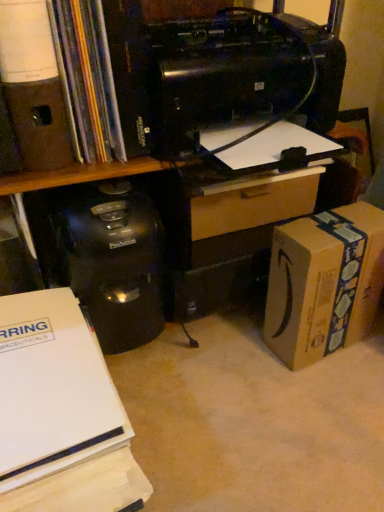
Locate an element on the screen. This screenshot has height=512, width=384. matte brown speaker at upper left, which is the 1th office supplies from top to bottom is located at coordinates (34, 85).

Describe the element at coordinates (323, 283) in the screenshot. This screenshot has height=512, width=384. I see `brown cardboard box at lower right` at that location.

This screenshot has height=512, width=384. Find the location of `wooden drawer at center`. wooden drawer at center is located at coordinates (253, 202).

What is the approximate width of wooden drawer at center?

The width of wooden drawer at center is 3.94 inches.

Describe the element at coordinates (60, 412) in the screenshot. The width and height of the screenshot is (384, 512). I see `white paper at lower left, placed as the 2th office supplies when sorted from top to bottom` at that location.

The width and height of the screenshot is (384, 512). What are the coordinates of `matte brown speaker at upper left, placed as the second office supplies when sorted from bottom to top` in the screenshot? It's located at (34, 85).

Do you think white paper at lower left, positioned as the 1th office supplies in bottom-to-top order, is within matte brown speaker at upper left, placed as the second office supplies when sorted from bottom to top, or outside of it?

white paper at lower left, positioned as the 1th office supplies in bottom-to-top order, lies outside matte brown speaker at upper left, placed as the second office supplies when sorted from bottom to top.

Which is in front, point (58, 398) or point (43, 108)?

The point (58, 398) is in front.

Is white paper at lower left, positioned as the 1th office supplies in bottom-to-top order, with matte brown speaker at upper left, placed as the second office supplies when sorted from bottom to top?

white paper at lower left, positioned as the 1th office supplies in bottom-to-top order, and matte brown speaker at upper left, placed as the second office supplies when sorted from bottom to top, are clearly separated.

Can you tell me how much white paper at lower left, placed as the 2th office supplies when sorted from top to bottom, and matte brown speaker at upper left, placed as the second office supplies when sorted from bottom to top, differ in facing direction?

2.11 degrees.

You are a GUI agent. You are given a task and a screenshot of the screen. Output one action in this format:
    pyautogui.click(x=<x>, y=<y>)
    Task: Click on the printer located on the left of wooden drawer at center
    The height and width of the screenshot is (512, 384).
    Given the screenshot: What is the action you would take?
    pos(219,75)

In the image, is black plastic printer at upper center positioned in front of or behind wooden drawer at center?

black plastic printer at upper center is in front of wooden drawer at center.

Is black plastic printer at upper center oriented towards wooden drawer at center?

No, black plastic printer at upper center is not turned towards wooden drawer at center.

From the image's perspective, is black plastic printer at upper center beneath wooden drawer at center?

No, from the image's perspective, black plastic printer at upper center is not below wooden drawer at center.

Does matte brown speaker at upper left, placed as the second office supplies when sorted from bottom to top, lie behind matte black book at upper left?

No, matte brown speaker at upper left, placed as the second office supplies when sorted from bottom to top, is in front of matte black book at upper left.

Considering the sizes of objects matte brown speaker at upper left, which is the 1th office supplies from top to bottom, and matte black book at upper left in the image provided, who is taller, matte brown speaker at upper left, which is the 1th office supplies from top to bottom, or matte black book at upper left?

matte brown speaker at upper left, which is the 1th office supplies from top to bottom, is taller.

Would you consider matte brown speaker at upper left, which is the 1th office supplies from top to bottom, to be distant from matte black book at upper left?

matte brown speaker at upper left, which is the 1th office supplies from top to bottom, is actually quite close to matte black book at upper left.

From the image's perspective, which one is positioned lower, matte brown speaker at upper left, placed as the second office supplies when sorted from bottom to top, or matte black book at upper left?

matte brown speaker at upper left, placed as the second office supplies when sorted from bottom to top, is shown below in the image.

Starting from the brown cardboard box at lower right, which office supplies is the 1st one to the left? Please provide its 2D coordinates.

[(60, 412)]

Is brown cardboard box at lower right far from white paper at lower left, placed as the 2th office supplies when sorted from top to bottom?

No, there isn't a large distance between brown cardboard box at lower right and white paper at lower left, placed as the 2th office supplies when sorted from top to bottom.

How many degrees apart are the facing directions of matte brown speaker at upper left, placed as the second office supplies when sorted from bottom to top, and black plastic printer at upper center?

2.18 degrees separate the facing orientations of matte brown speaker at upper left, placed as the second office supplies when sorted from bottom to top, and black plastic printer at upper center.

Is matte brown speaker at upper left, placed as the second office supplies when sorted from bottom to top, bigger or smaller than black plastic printer at upper center?

matte brown speaker at upper left, placed as the second office supplies when sorted from bottom to top, is smaller than black plastic printer at upper center.

This screenshot has height=512, width=384. I want to click on the 1st office supplies positioned below the black plastic printer at upper center (from the image's perspective), so click(x=34, y=85).

Which is behind, matte brown speaker at upper left, which is the 1th office supplies from top to bottom, or black plastic printer at upper center?

matte brown speaker at upper left, which is the 1th office supplies from top to bottom.

From a real-world perspective, is white paper at lower left, placed as the 2th office supplies when sorted from top to bottom, over brown cardboard box at lower right?

No, from a real-world perspective, white paper at lower left, placed as the 2th office supplies when sorted from top to bottom, is not on top of brown cardboard box at lower right.

Could you measure the distance between white paper at lower left, placed as the 2th office supplies when sorted from top to bottom, and brown cardboard box at lower right?

A distance of 18.39 inches exists between white paper at lower left, placed as the 2th office supplies when sorted from top to bottom, and brown cardboard box at lower right.

Visually, is white paper at lower left, positioned as the 1th office supplies in bottom-to-top order, positioned to the left or to the right of brown cardboard box at lower right?

From the image, it's evident that white paper at lower left, positioned as the 1th office supplies in bottom-to-top order, is to the left of brown cardboard box at lower right.

Considering the sizes of white paper at lower left, positioned as the 1th office supplies in bottom-to-top order, and brown cardboard box at lower right in the image, is white paper at lower left, positioned as the 1th office supplies in bottom-to-top order, wider or thinner than brown cardboard box at lower right?

white paper at lower left, positioned as the 1th office supplies in bottom-to-top order, is wider than brown cardboard box at lower right.

Does brown cardboard box at lower right have a lesser width compared to matte black book at upper left?

Yes, brown cardboard box at lower right is thinner than matte black book at upper left.

Where is `book in front of the brown cardboard box at lower right`? The height and width of the screenshot is (512, 384). book in front of the brown cardboard box at lower right is located at coordinates 87,77.

Which is closer, (353, 290) or (56, 27)?

Point (56, 27)

From the image's perspective, does brown cardboard box at lower right appear higher than matte black book at upper left?

No, from the image's perspective, brown cardboard box at lower right is not on top of matte black book at upper left.

Find the location of a particular element. office supplies that is in front of the matte brown speaker at upper left, which is the 1th office supplies from top to bottom is located at coordinates 60,412.

Find the location of a particular element. drawer behind the black plastic printer at upper center is located at coordinates (253, 202).

Based on their spatial positions, is brown cardboard box at lower right or wooden drawer at center further from matte brown speaker at upper left, placed as the second office supplies when sorted from bottom to top?

Based on the image, brown cardboard box at lower right appears to be further to matte brown speaker at upper left, placed as the second office supplies when sorted from bottom to top.

Based on their spatial positions, is brown cardboard box at lower right or matte black book at upper left closer to white paper at lower left, positioned as the 1th office supplies in bottom-to-top order?

The object closer to white paper at lower left, positioned as the 1th office supplies in bottom-to-top order, is matte black book at upper left.

When comparing their distances from matte brown speaker at upper left, placed as the second office supplies when sorted from bottom to top, does black plastic printer at upper center or wooden drawer at center seem closer?

Based on the image, black plastic printer at upper center appears to be nearer to matte brown speaker at upper left, placed as the second office supplies when sorted from bottom to top.

Which object lies nearer to the anchor point white paper at lower left, placed as the 2th office supplies when sorted from top to bottom, matte black book at upper left or matte brown speaker at upper left, placed as the second office supplies when sorted from bottom to top?

matte brown speaker at upper left, placed as the second office supplies when sorted from bottom to top, lies closer to white paper at lower left, placed as the 2th office supplies when sorted from top to bottom, than the other object.

From the image, which object appears to be farther from matte black book at upper left, white paper at lower left, positioned as the 1th office supplies in bottom-to-top order, or black plastic printer at upper center?

The object further to matte black book at upper left is white paper at lower left, positioned as the 1th office supplies in bottom-to-top order.

Considering their positions, is matte brown speaker at upper left, placed as the second office supplies when sorted from bottom to top, positioned closer to matte black book at upper left than brown cardboard box at lower right?

matte brown speaker at upper left, placed as the second office supplies when sorted from bottom to top, is closer to matte black book at upper left.

Which object lies nearer to the anchor point matte black book at upper left, wooden drawer at center or black plastic printer at upper center?

black plastic printer at upper center lies closer to matte black book at upper left than the other object.

From the image, which object appears to be nearer to brown cardboard box at lower right, matte black book at upper left or white paper at lower left, placed as the 2th office supplies when sorted from top to bottom?

Based on the image, white paper at lower left, placed as the 2th office supplies when sorted from top to bottom, appears to be nearer to brown cardboard box at lower right.

Identify the location of book situated between matte brown speaker at upper left, which is the 1th office supplies from top to bottom, and brown cardboard box at lower right from left to right. This screenshot has width=384, height=512. (87, 77).

What are the coordinates of `printer between matte brown speaker at upper left, placed as the second office supplies when sorted from bottom to top, and wooden drawer at center from left to right` in the screenshot? It's located at (219, 75).

Locate an element on the screen. The width and height of the screenshot is (384, 512). drawer situated between matte brown speaker at upper left, which is the 1th office supplies from top to bottom, and brown cardboard box at lower right from left to right is located at coordinates (253, 202).

What are the coordinates of `book between black plastic printer at upper center and wooden drawer at center from front to back` in the screenshot? It's located at (87, 77).